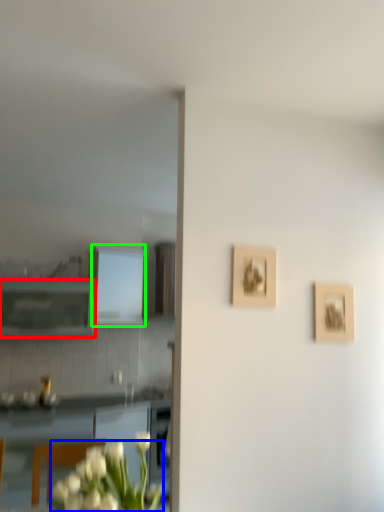
Question: Which object is the farthest from cabinetry (highlighted by a red box)? Choose among these: flower (highlighted by a blue box) or cabinetry (highlighted by a green box).

Choices:
 (A) flower
 (B) cabinetry

Answer: (A)